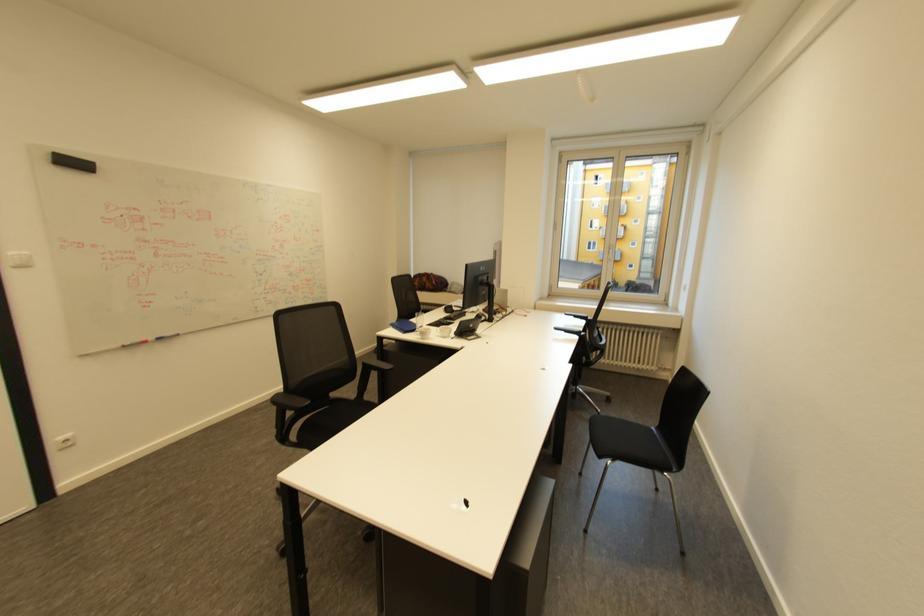
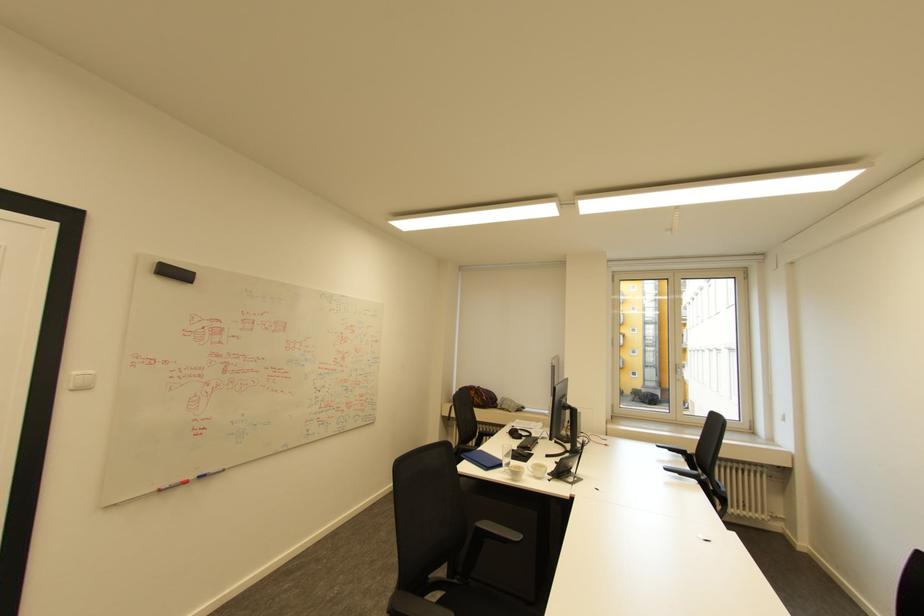
In the second image, find the point that corresponds to (616,246) in the first image.

(683, 365)